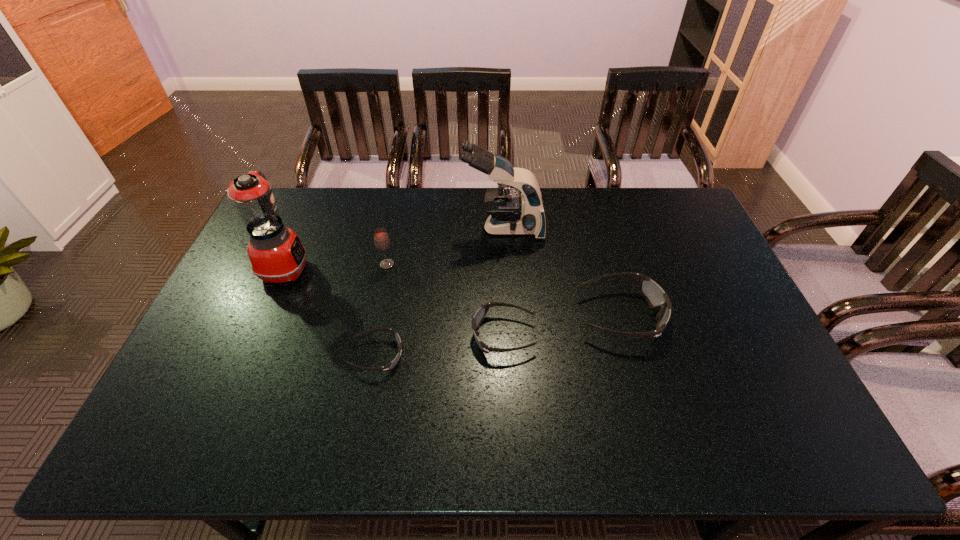
Locate an element on the screen. This screenshot has height=540, width=960. vacant space located on the lenses of the second shortest object is located at coordinates (436, 335).

Find the location of a particular element. The image size is (960, 540). free spot located 0.080m on the lenses of the second shortest object is located at coordinates (443, 335).

In order to click on vacant region located on the lenses of the second shortest object in this screenshot , I will do `click(334, 335)`.

Locate an element on the screen. free space located on the lenses of the tallest sunglasses is located at coordinates (751, 316).

I want to click on free space located 0.160m on the controls of the food processor, so click(x=360, y=268).

This screenshot has height=540, width=960. I want to click on vacant space located through the eyepieces of the microscope, so click(388, 228).

The width and height of the screenshot is (960, 540). Identify the location of vacant space positioned 0.200m through the eyepieces of the microscope. (405, 228).

Identify the location of free space located through the eyepieces of the microscope. Image resolution: width=960 pixels, height=540 pixels. (399, 228).

The width and height of the screenshot is (960, 540). I want to click on vacant space situated on the back of the glass drink container, so click(400, 201).

Locate an element on the screen. object located at the far edge is located at coordinates (509, 214).